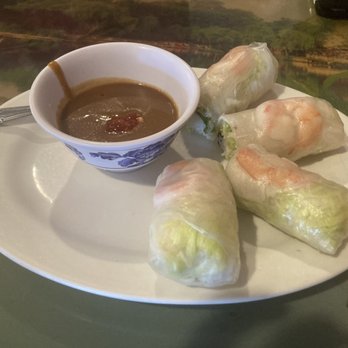
This screenshot has height=348, width=348. Find the location of `blue flower designs on the side of the bowl`. blue flower designs on the side of the bowl is located at coordinates (136, 157).